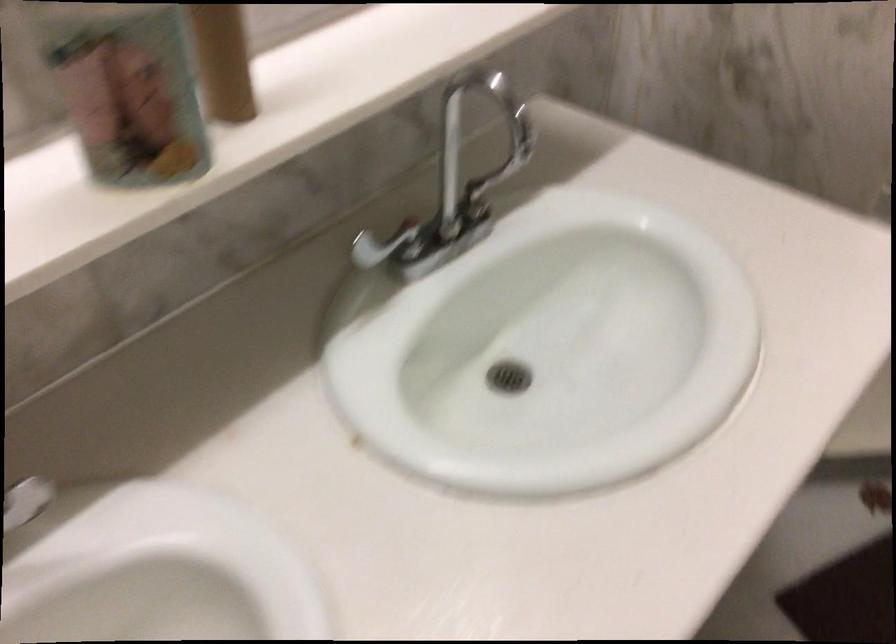
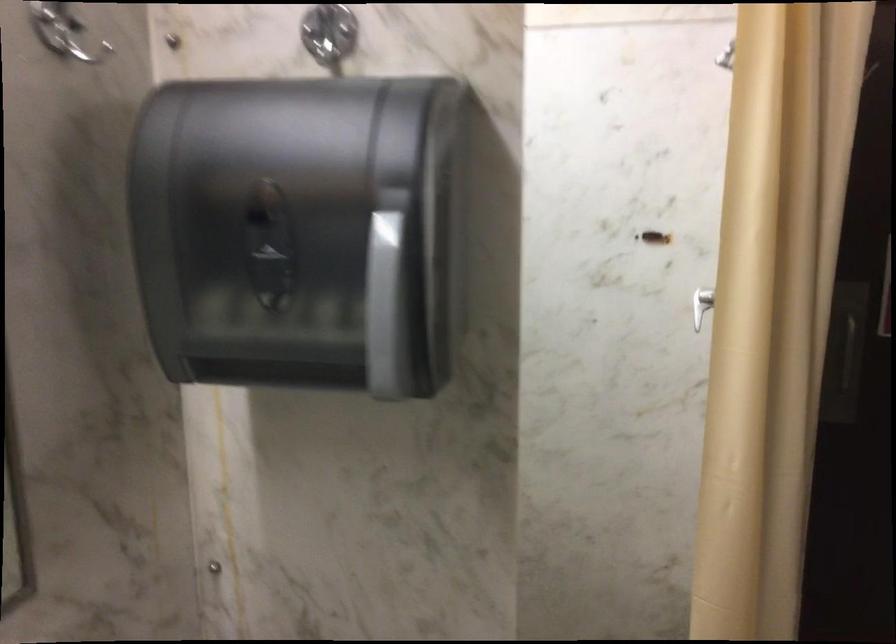
Based on the continuous images, in which direction is the camera rotating?

The camera rotated toward right-up.